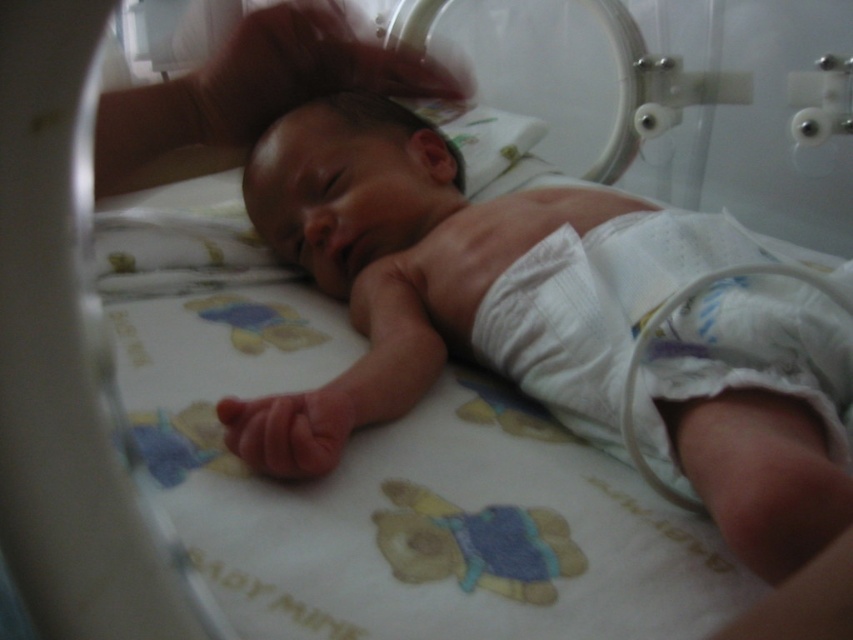
Based on the scene description, where is the smooth white newborn at center located in terms of its 2D coordinates?

The smooth white newborn at center is located at the 2D coordinates of point (549, 314).

You are a nurse looking at the incubator. There are two points marked on the incubator wall at coordinates point (x=694, y=241) and point (x=566, y=419). Which point is closer to you?

Point (x=566, y=419) is closer to you because it is less further away than point (x=694, y=241).

From the picture: You are a nurse in a hospital nursery. You need to determine if the smooth white newborn at center can be safely placed on top of the white cloth diaper at lower right without the diaper slipping out from underneath. Based on their sizes, what should you consider?

The smooth white newborn at center is taller than the white cloth diaper at lower right, so the diaper may not provide enough coverage or stability. Ensure the diaper is large enough or use a larger diaper to prevent slipping.